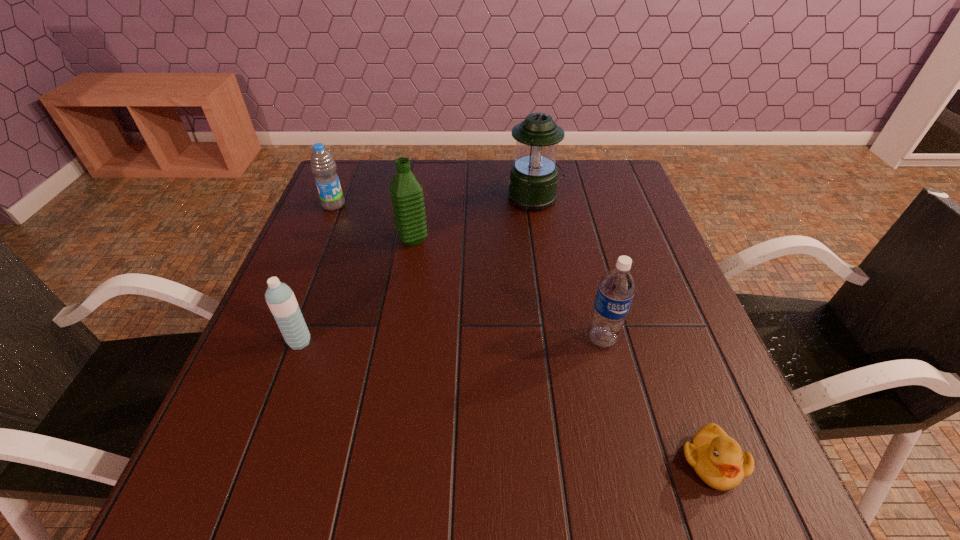
The height and width of the screenshot is (540, 960). Identify the location of lantern. (533, 178).

Where is `the third nearest water bottle`? the third nearest water bottle is located at coordinates (407, 194).

Where is `the fourth object from right to left`? the fourth object from right to left is located at coordinates (407, 194).

Where is `the rightmost water bottle`? the rightmost water bottle is located at coordinates (616, 289).

Where is `the farthest water bottle`? the farthest water bottle is located at coordinates (323, 166).

Locate an element on the screen. The image size is (960, 540). the rightmost object is located at coordinates (718, 460).

Find the location of a particular element. the shortest object is located at coordinates (718, 460).

The height and width of the screenshot is (540, 960). I want to click on free space located 0.180m on the front of the lantern, so click(543, 257).

You are a GUI agent. You are given a task and a screenshot of the screen. Output one action in this format:
    pyautogui.click(x=<x>, y=<y>)
    Task: Click on the free space located 0.350m on the back of the fourth nearest object
    The image size is (960, 540).
    Given the screenshot: What is the action you would take?
    pyautogui.click(x=426, y=163)

You are a GUI agent. You are given a task and a screenshot of the screen. Output one action in this format:
    pyautogui.click(x=<x>, y=<y>)
    Task: Click on the vacant area situated on the back of the rightmost water bottle
    
    Given the screenshot: What is the action you would take?
    pyautogui.click(x=582, y=261)